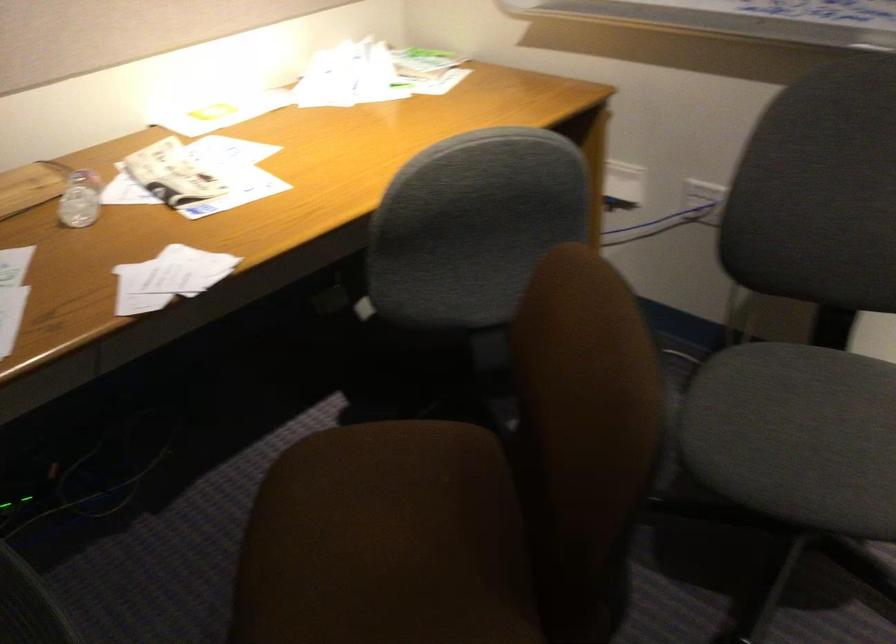
Where would you lift the folded newspaper? Please return your answer as a coordinate pair (x, y).

(173, 174)